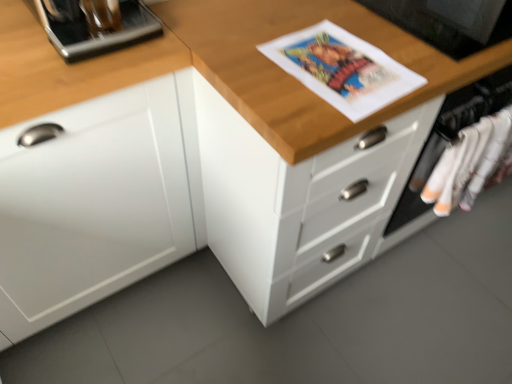
Question: Considering the relative sizes of white matte cabinet at left and black glossy monitor at upper right, marked as the first appliance in a right-to-left arrangement, in the image provided, is white matte cabinet at left wider than black glossy monitor at upper right, marked as the first appliance in a right-to-left arrangement,?

Choices:
 (A) no
 (B) yes

Answer: (B)

Question: Can you confirm if white matte cabinet at left is thinner than black glossy monitor at upper right, marked as the first appliance in a right-to-left arrangement?

Choices:
 (A) no
 (B) yes

Answer: (A)

Question: Does white matte cabinet at left have a greater height compared to black glossy monitor at upper right, marked as the first appliance in a right-to-left arrangement?

Choices:
 (A) yes
 (B) no

Answer: (A)

Question: Does white matte cabinet at left lie behind black glossy monitor at upper right, marked as the first appliance in a right-to-left arrangement?

Choices:
 (A) yes
 (B) no

Answer: (B)

Question: Is white matte cabinet at left facing away from black glossy monitor at upper right, marked as the first appliance in a right-to-left arrangement?

Choices:
 (A) no
 (B) yes

Answer: (A)

Question: From the image's perspective, is metallic silver coffee machine at upper left, which ranks as the second appliance in right-to-left order, located above or below white matte cabinet at left?

Choices:
 (A) below
 (B) above

Answer: (B)

Question: In terms of size, does metallic silver coffee machine at upper left, which ranks as the second appliance in right-to-left order, appear bigger or smaller than white matte cabinet at left?

Choices:
 (A) big
 (B) small

Answer: (B)

Question: Is metallic silver coffee machine at upper left, placed as the first appliance when sorted from left to right, taller or shorter than white matte cabinet at left?

Choices:
 (A) tall
 (B) short

Answer: (B)

Question: Considering the relative positions of metallic silver coffee machine at upper left, placed as the first appliance when sorted from left to right, and white matte cabinet at left in the image provided, is metallic silver coffee machine at upper left, placed as the first appliance when sorted from left to right, to the left or to the right of white matte cabinet at left?

Choices:
 (A) right
 (B) left

Answer: (A)

Question: Is point (461, 160) positioned closer to the camera than point (466, 21)?

Choices:
 (A) closer
 (B) farther

Answer: (B)

Question: Based on their positions, is white cotton socks at right located to the left or right of black glossy monitor at upper right, acting as the second appliance starting from the left?

Choices:
 (A) right
 (B) left

Answer: (A)

Question: From a real-world perspective, is white cotton socks at right above or below black glossy monitor at upper right, acting as the second appliance starting from the left?

Choices:
 (A) below
 (B) above

Answer: (A)

Question: Is white cotton socks at right in front of or behind black glossy monitor at upper right, marked as the first appliance in a right-to-left arrangement, in the image?

Choices:
 (A) behind
 (B) front

Answer: (A)

Question: From a real-world perspective, is wooden chest of drawers at center positioned above or below black glossy monitor at upper right, marked as the first appliance in a right-to-left arrangement?

Choices:
 (A) above
 (B) below

Answer: (B)

Question: Is wooden chest of drawers at center in front of or behind black glossy monitor at upper right, marked as the first appliance in a right-to-left arrangement, in the image?

Choices:
 (A) behind
 (B) front

Answer: (B)